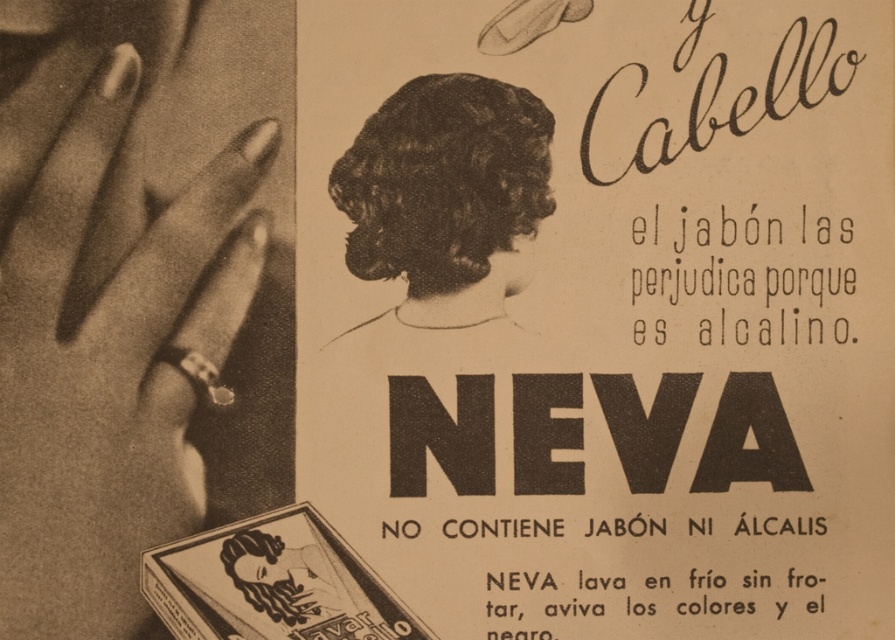
Does metallic ring at left have a smaller size compared to dark curly hair at center?

No, metallic ring at left is not smaller than dark curly hair at center.

Describe the element at coordinates (104, 310) in the screenshot. I see `metallic ring at left` at that location.

What are the coordinates of `metallic ring at left` in the screenshot? It's located at (104, 310).

Is matte paper advertisement at center closer to the viewer compared to metallic ring at left?

No, matte paper advertisement at center is behind metallic ring at left.

Is point (602, 243) positioned in front of point (112, 339)?

No, (602, 243) is behind (112, 339).

Is point (393, 513) positioned after point (58, 161)?

Yes, point (393, 513) is farther from viewer.

I want to click on matte paper advertisement at center, so click(608, 310).

Does matte paper advertisement at center appear over dark curly hair at center?

No.

Who is higher up, matte paper advertisement at center or dark curly hair at center?

dark curly hair at center is higher up.

The width and height of the screenshot is (895, 640). I want to click on matte paper advertisement at center, so click(x=608, y=310).